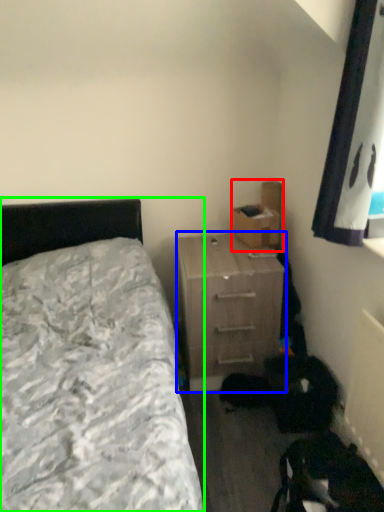
Question: Considering the real-world distances, which object is farthest from cardboard box (highlighted by a red box)? nightstand (highlighted by a blue box) or bed (highlighted by a green box)?

Choices:
 (A) nightstand
 (B) bed

Answer: (B)